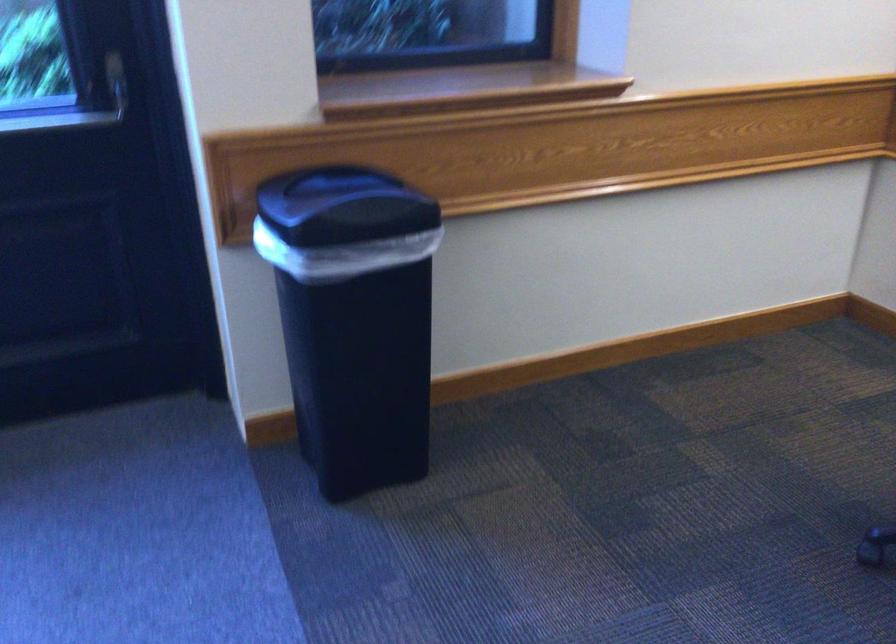
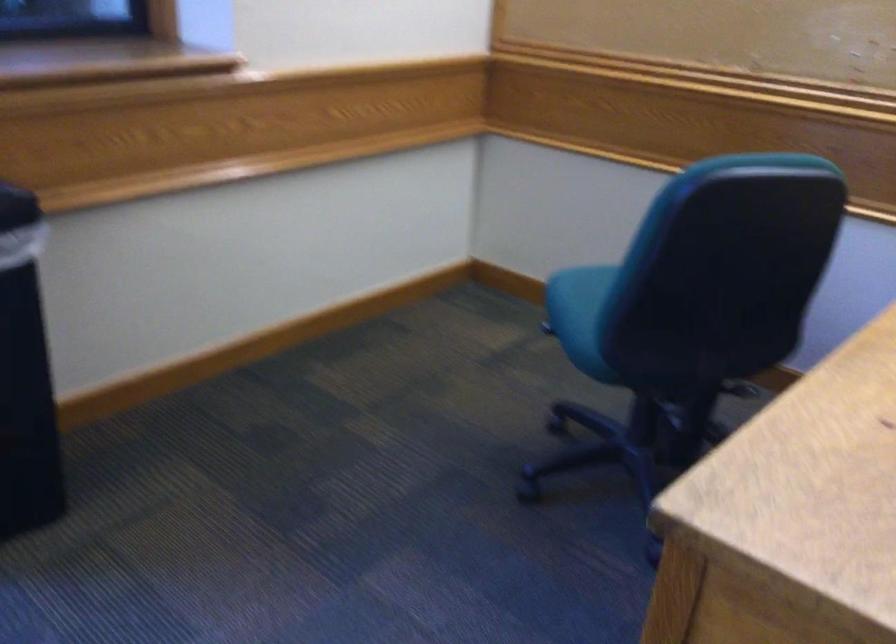
Question: The camera is either moving clockwise (left) or counter-clockwise (right) around the object. The first image is from the beginning of the video and the second image is from the end. Is the camera moving left or right when shooting the video?

Choices:
 (A) Left
 (B) Right

Answer: (A)